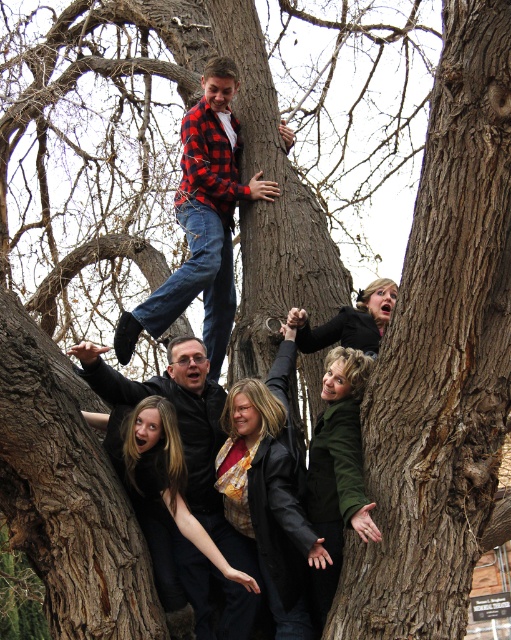
Is plaid flannel shirt at center to the left of green matte jacket at lower center from the viewer's perspective?

Correct, you'll find plaid flannel shirt at center to the left of green matte jacket at lower center.

Does plaid flannel shirt at center have a lesser height compared to green matte jacket at lower center?

Correct, plaid flannel shirt at center is not as tall as green matte jacket at lower center.

Measure the distance between plaid flannel shirt at center and camera.

plaid flannel shirt at center is 134.17 feet from camera.

Identify the location of plaid flannel shirt at center. The image size is (511, 640). (161, 500).

Can you confirm if red plaid shirt at upper center is wider than plaid flannel shirt at center?

Correct, the width of red plaid shirt at upper center exceeds that of plaid flannel shirt at center.

Who is positioned more to the right, red plaid shirt at upper center or plaid flannel shirt at center?

Positioned to the right is red plaid shirt at upper center.

Is point (212, 150) positioned behind point (179, 488)?

Yes.

Identify the location of red plaid shirt at upper center. (202, 221).

Who is positioned more to the left, red plaid shirt at upper center or green matte jacket at lower center?

red plaid shirt at upper center

Is point (192, 116) positioned behind point (350, 397)?

That is True.

Identify the location of red plaid shirt at upper center. (202, 221).